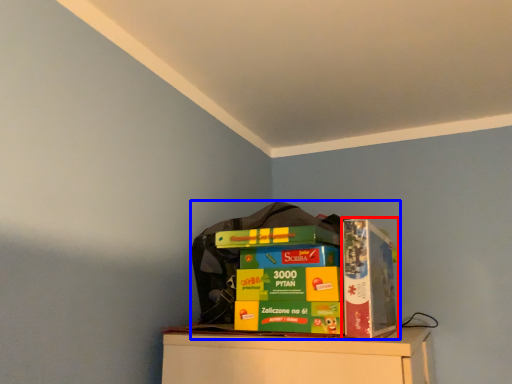
Question: Which of the following is the closest to the observer, paperback book (highlighted by a red box) or collection (highlighted by a blue box)?

Choices:
 (A) paperback book
 (B) collection

Answer: (B)